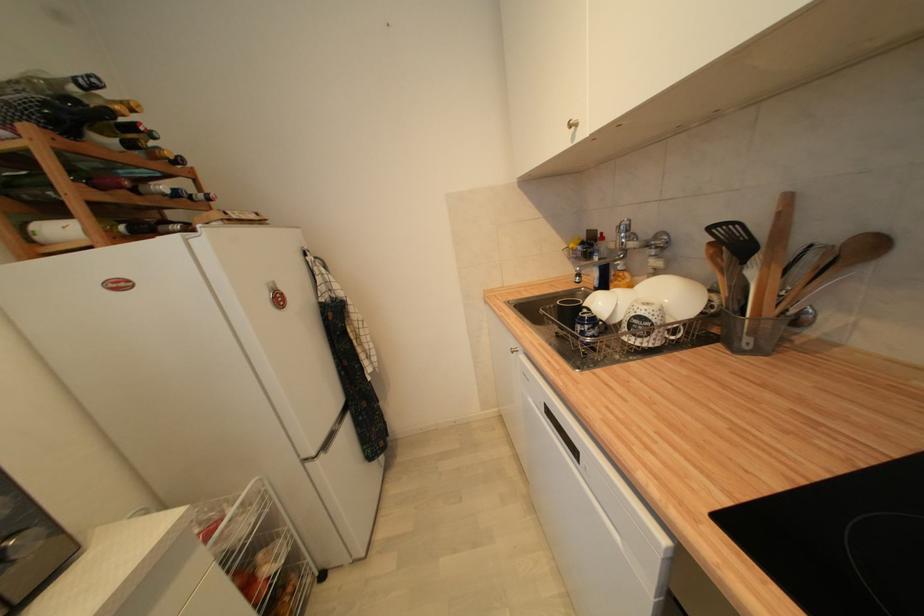
The width and height of the screenshot is (924, 616). I want to click on recessed dishwasher handle, so click(567, 442).